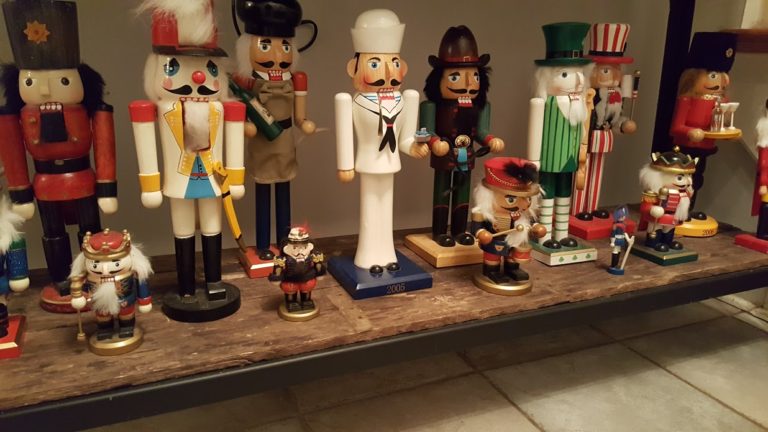
I want to click on wall, so pyautogui.click(x=508, y=64).